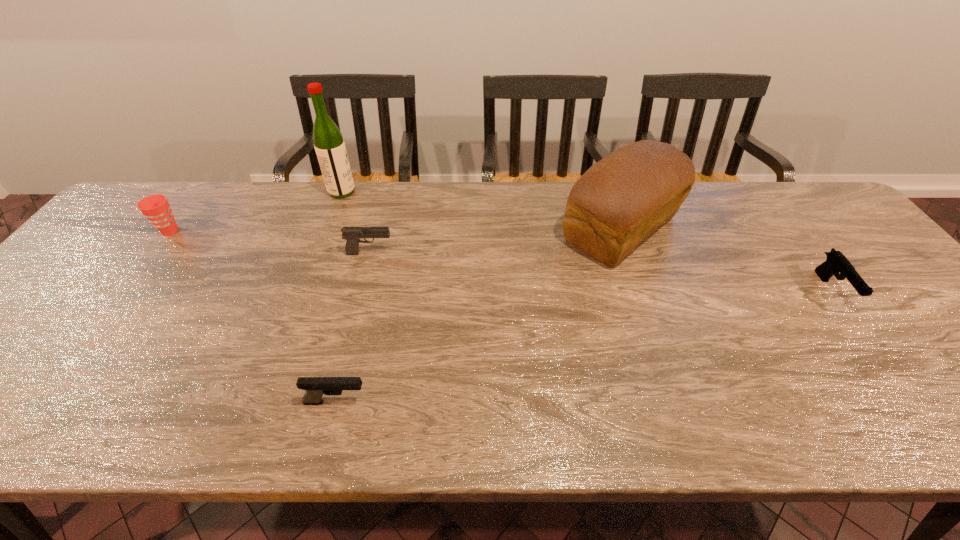
This screenshot has width=960, height=540. Find the location of `unoccupied area between the rightmost pistol and the farthest pistol`. unoccupied area between the rightmost pistol and the farthest pistol is located at coordinates (601, 272).

This screenshot has width=960, height=540. Find the location of `blank region between the bread and the farthest pistol`. blank region between the bread and the farthest pistol is located at coordinates coord(495,241).

Where is `vacant area that lies between the rightmost object and the nearest pistol`? This screenshot has width=960, height=540. vacant area that lies between the rightmost object and the nearest pistol is located at coordinates (584, 346).

Locate an element on the screen. The height and width of the screenshot is (540, 960). free space between the farthest pistol and the cup is located at coordinates (270, 242).

Where is `empty space between the second object from left to right and the nearest pistol`? empty space between the second object from left to right and the nearest pistol is located at coordinates (339, 297).

Identify the location of object identified as the third closest to the tallest object. (618, 202).

Select which object is the fourth closest to the farthest pistol. Please provide its 2D coordinates. Your answer should be formatted as a tuple, i.e. [(x, y)], where the tuple contains the x and y coordinates of a point satisfying the conditions above.

[(156, 208)]

Where is `pistol that is the closest to the second nearest pistol`? The width and height of the screenshot is (960, 540). pistol that is the closest to the second nearest pistol is located at coordinates (351, 234).

Select which pistol appears as the third closest to the bread. Please provide its 2D coordinates. Your answer should be formatted as a tuple, i.e. [(x, y)], where the tuple contains the x and y coordinates of a point satisfying the conditions above.

[(315, 387)]

Locate an element on the screen. Image resolution: width=960 pixels, height=540 pixels. free location that satisfies the following two spatial constraints: 1. on the label of the fifth object from right to left; 2. on the right side of the second tallest object is located at coordinates (328, 229).